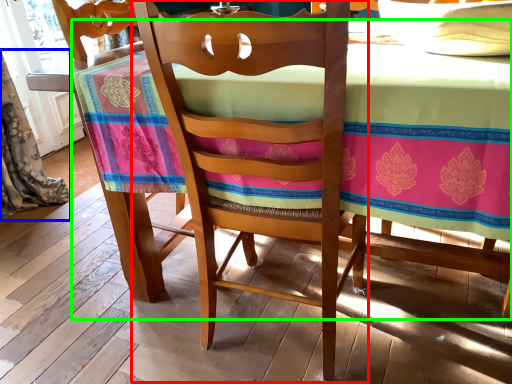
Question: Considering the real-world distances, which object is closest to chair (highlighted by a red box)? curtain (highlighted by a blue box) or table (highlighted by a green box).

Choices:
 (A) curtain
 (B) table

Answer: (B)